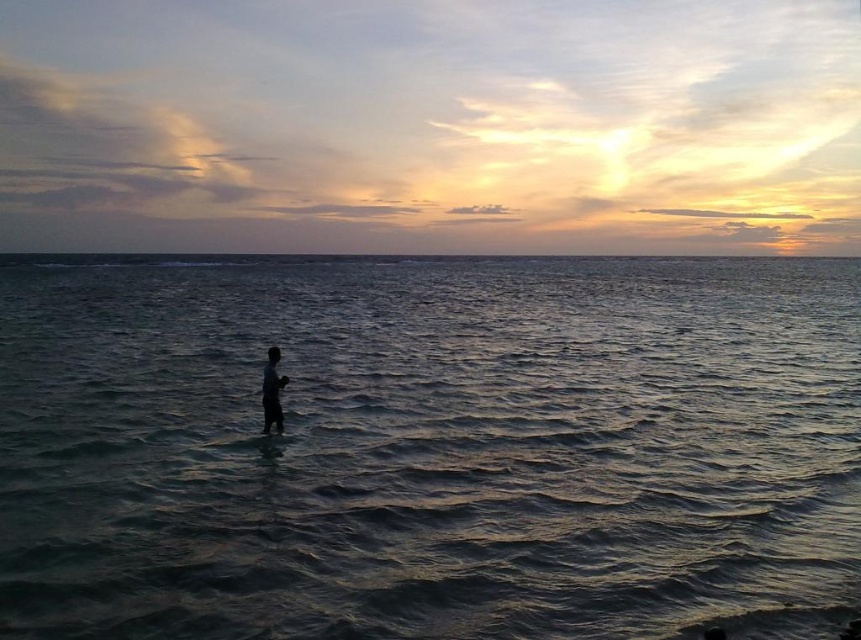
You are a drone operator trying to capture the sunset scene. Your drone is currently at the center of the image. You need to adjust its position to focus on the dark blue water at center. According to the coordinates provided, should you move the drone slightly upwards or downwards?

The dark blue water at center is located at point 0.700 on the x axis and 0.499 on the y axis. Since the drone is at the center of the image, which is at coordinates (x=430, y=320), you should move the drone slightly upwards because the y coordinate of the dark blue water at center is 0.499, which is just below the center point. Moving upwards would bring the drone closer to the water.

You are standing at the edge of the ocean watching the sunset. There is a point marked at coordinates (429,448). Based on the scene description, what color is the water at that point?

The point at (429,448) indicates dark blue water at center, so the water there is dark blue.